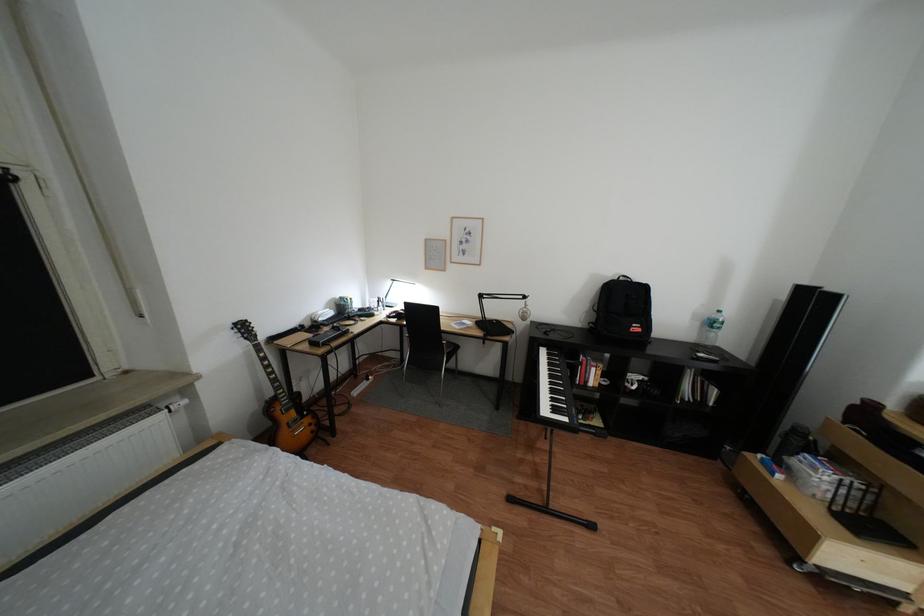
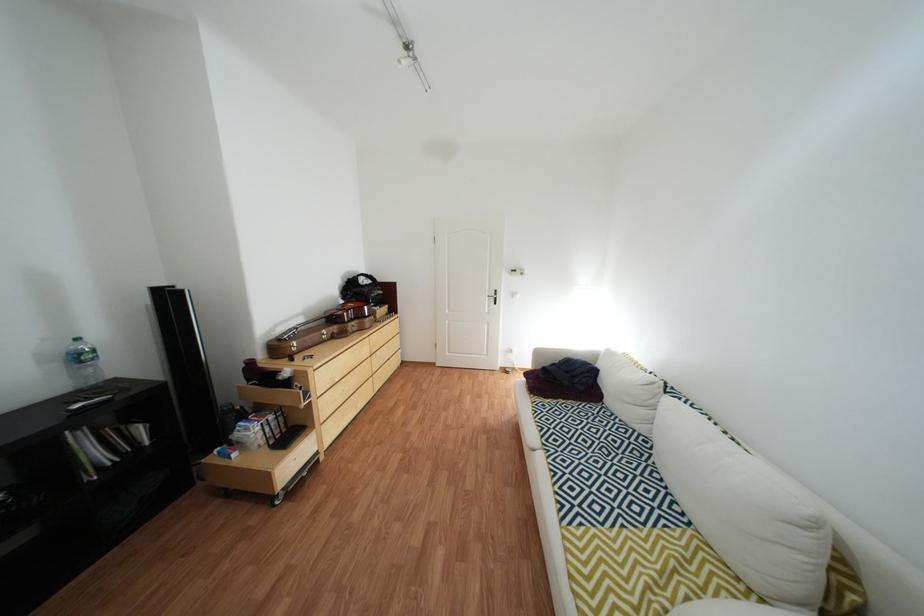
The images are taken continuously from a first-person perspective. In which direction is your viewpoint rotating?

The camera rotated toward right-down.